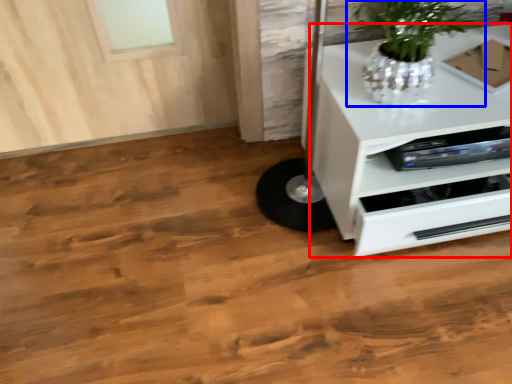
Question: Which object is closer to the camera taking this photo, chest of drawers (highlighted by a red box) or houseplant (highlighted by a blue box)?

Choices:
 (A) chest of drawers
 (B) houseplant

Answer: (B)